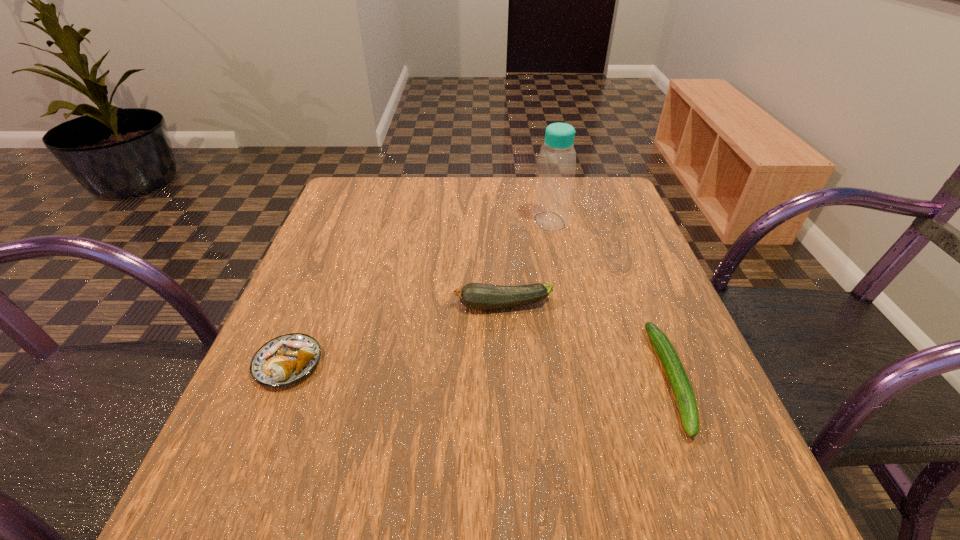
Locate an element on the screen. bottle is located at coordinates (556, 166).

Find the location of a particular element. Image resolution: width=960 pixels, height=540 pixels. the tallest object is located at coordinates (556, 166).

You are a GUI agent. You are given a task and a screenshot of the screen. Output one action in this format:
    pyautogui.click(x=<x>, y=<y>)
    Task: Click on the farther zucchini
    This screenshot has width=960, height=540.
    Given the screenshot: What is the action you would take?
    pyautogui.click(x=482, y=296)

Find the location of a particular element. the taller zucchini is located at coordinates (482, 296).

Locate an element on the screen. pastry is located at coordinates (287, 359).

Identify the location of the third tallest object. (287, 359).

The height and width of the screenshot is (540, 960). Identify the location of the nearer zucchini. (678, 379).

You are a GUI agent. You are given a task and a screenshot of the screen. Output one action in this format:
    pyautogui.click(x=<x>, y=<y>)
    Task: Click on the shortest object
    
    Given the screenshot: What is the action you would take?
    pyautogui.click(x=678, y=379)

Locate an element on the screen. Image resolution: width=960 pixels, height=540 pixels. blank area located on the front of the farthest object is located at coordinates (572, 329).

Identify the location of free space located 0.210m at the blossom end of the third nearest object. The height and width of the screenshot is (540, 960). (346, 306).